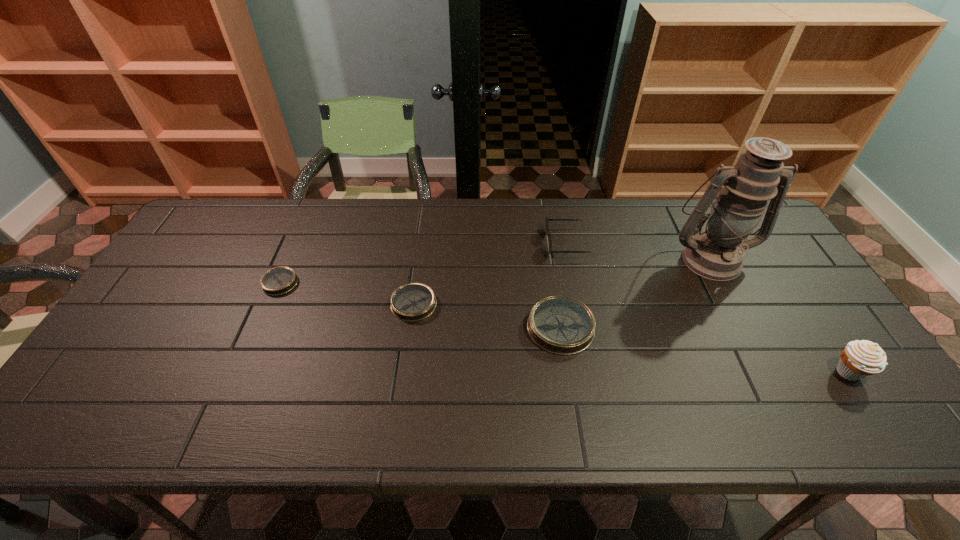
This screenshot has height=540, width=960. What are the coordinates of `oil lamp at the far edge` in the screenshot? It's located at (717, 253).

The height and width of the screenshot is (540, 960). Identify the location of object that is positioned at the near edge. (859, 359).

Where is `oil lamp that is at the right edge`? oil lamp that is at the right edge is located at coordinates (717, 253).

You are a GUI agent. You are given a task and a screenshot of the screen. Output one action in this format:
    pyautogui.click(x=<x>, y=<y>)
    Task: Click on the muffin that is at the right edge
    This screenshot has height=540, width=960.
    Given the screenshot: What is the action you would take?
    pyautogui.click(x=859, y=359)

Identify the location of object located in the far right corner section of the desktop. The image size is (960, 540). (717, 253).

Locate an element on the screen. This screenshot has width=960, height=540. object at the near right corner is located at coordinates (859, 359).

Locate an element on the screen. vacant region at the far edge of the desktop is located at coordinates (580, 213).

Find the location of a particular element. Image resolution: width=960 pixels, height=540 pixels. vacant space at the near edge of the desktop is located at coordinates (562, 397).

The width and height of the screenshot is (960, 540). In order to click on vacant point at the left edge in this screenshot , I will do `click(180, 309)`.

This screenshot has width=960, height=540. In the image, there is a desktop. Find the location of `free space at the right edge`. free space at the right edge is located at coordinates (787, 308).